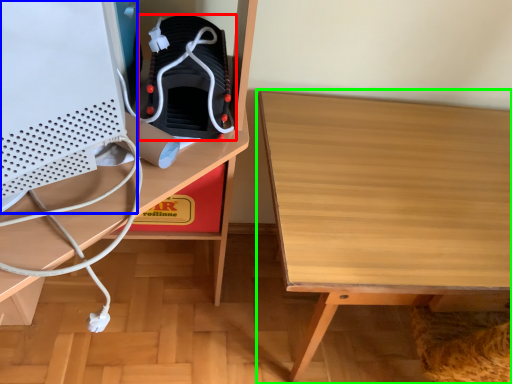
Question: Considering the real-world distances, which object is closest to footwear (highlighted by a red box)? desktop computer (highlighted by a blue box) or table (highlighted by a green box).

Choices:
 (A) desktop computer
 (B) table

Answer: (A)